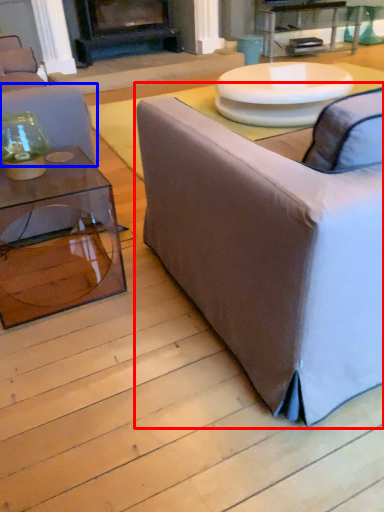
Question: Which object appears farthest to the camera in this image, studio couch (highlighted by a red box) or studio couch (highlighted by a blue box)?

Choices:
 (A) studio couch
 (B) studio couch

Answer: (B)